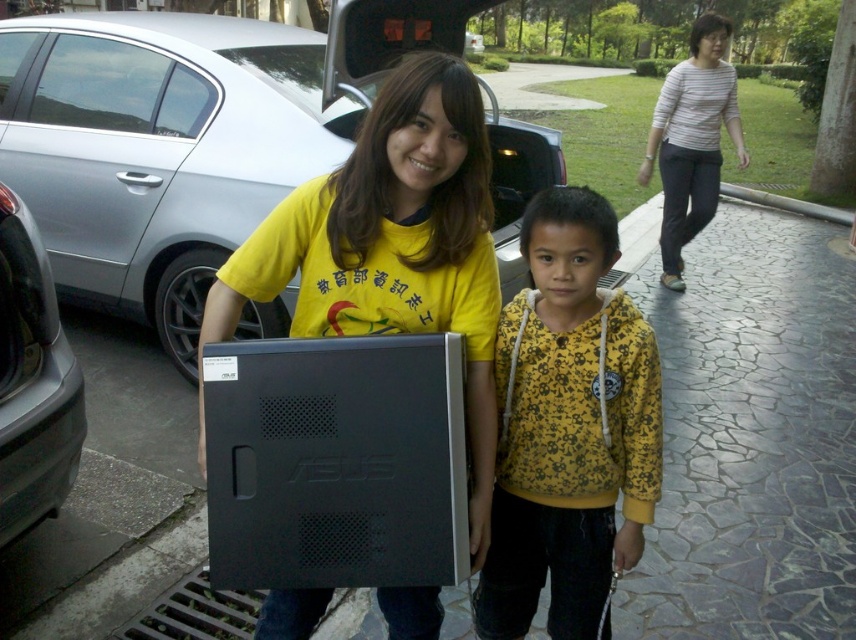
You are trying to decide whether to place a large potted plant between the satin silver sedan at center and the black plastic computer at center. Based on their sizes, which object should the plant be placed closer to?

The satin silver sedan at center is larger in size than the black plastic computer at center, so the plant should be placed closer to the satin silver sedan at center to maintain balance.

You are standing at the origin point of the image. The coordinates given are in a normalized system where the bottom left corner is 0,0 and the top right corner is 1,1. There is a point at (x=568, y=426). What object is located at this coordinate?

The point at (x=568, y=426) marks the yellow printed hoodie at center.

Consider the image. You are a photographer standing in front of the scene. You want to take a photo that includes both the matte black monitor at center and the striped cotton shirt at upper right. Which object should you focus on first to ensure both are in focus?

You should focus on the matte black monitor at center first because it is closer to the viewer than the striped cotton shirt at upper right, so adjusting focus from near to far will help both objects be in focus.